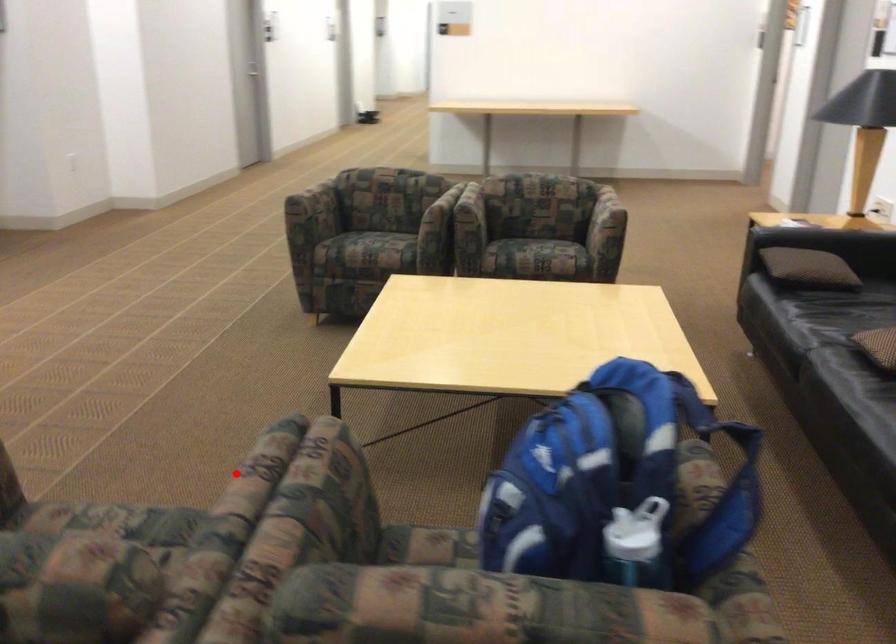
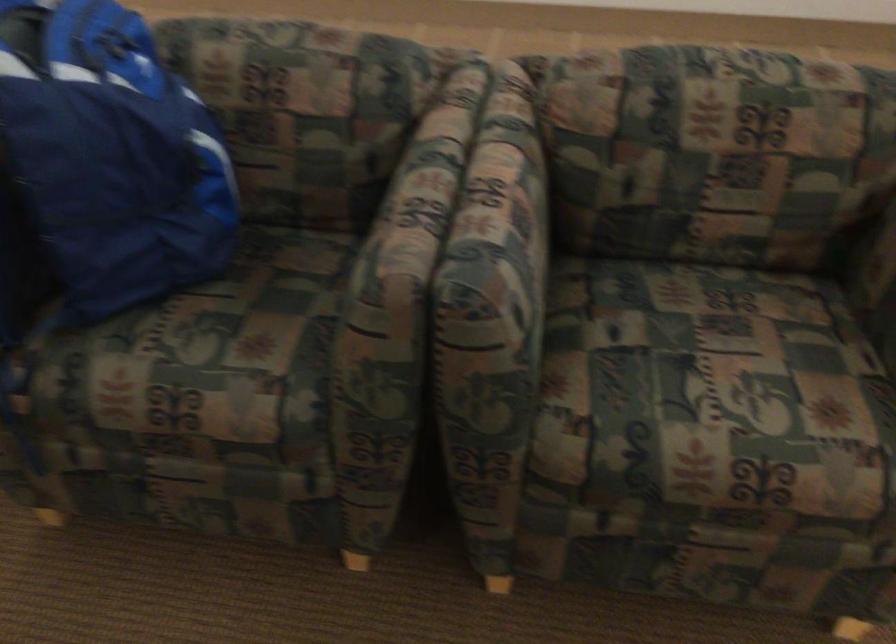
Question: I am providing you with two images of the same scene from different viewpoints. A red point is shown in image1. For the corresponding object point in image2, is it positioned nearer or farther from the camera?

Choices:
 (A) Nearer
 (B) Farther

Answer: (A)